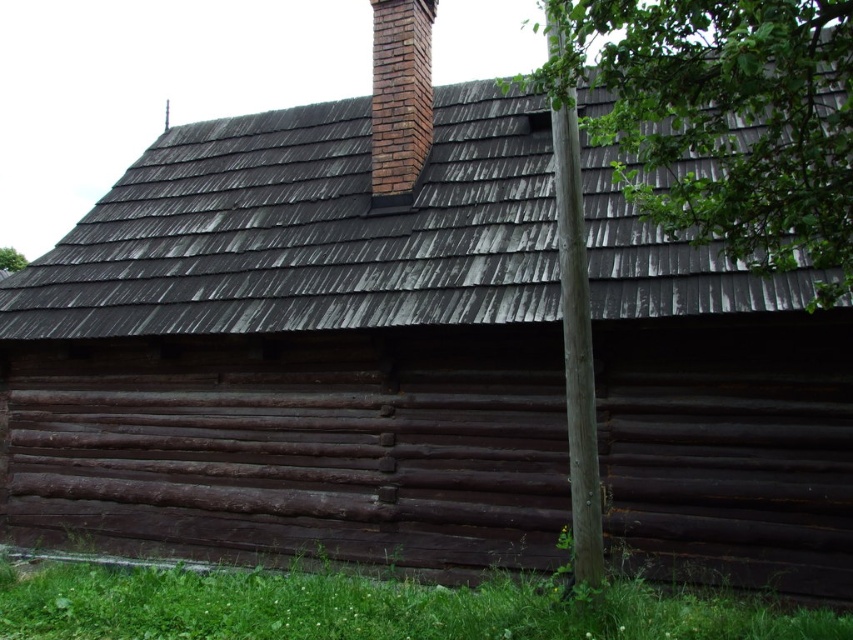
Which is behind, point (779, 243) or point (579, 189)?

The point (579, 189) is behind.

Is point (709, 186) closer to camera compared to point (585, 300)?

Yes, point (709, 186) is closer to viewer.

The width and height of the screenshot is (853, 640). What do you see at coordinates (722, 120) in the screenshot?
I see `green leafy tree at upper right` at bounding box center [722, 120].

Find the location of `green leafy tree at upper right`. green leafy tree at upper right is located at coordinates (722, 120).

Can you confirm if brick chimney at upper center is taller than green leafy tree at upper left?

Yes, brick chimney at upper center is taller than green leafy tree at upper left.

Who is shorter, brick chimney at upper center or green leafy tree at upper left?

With less height is green leafy tree at upper left.

Is point (430, 65) farther from camera compared to point (15, 259)?

No, (430, 65) is closer to viewer.

The width and height of the screenshot is (853, 640). Find the location of `brick chimney at upper center`. brick chimney at upper center is located at coordinates (399, 92).

Between point (582, 468) and point (20, 268), which one is positioned in front?

Point (582, 468)

Does smooth brown pole at center right have a lesser height compared to green leafy tree at upper left?

In fact, smooth brown pole at center right may be taller than green leafy tree at upper left.

Is point (569, 424) positioned after point (12, 262)?

No, (569, 424) is closer to viewer.

Locate an element on the screen. The height and width of the screenshot is (640, 853). smooth brown pole at center right is located at coordinates (577, 349).